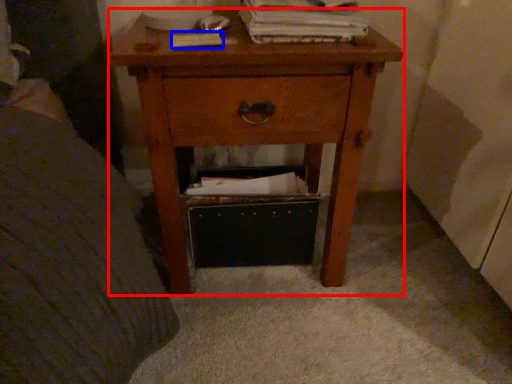
Question: Which object is closer to the camera taking this photo, nightstand (highlighted by a red box) or paperback book (highlighted by a blue box)?

Choices:
 (A) nightstand
 (B) paperback book

Answer: (A)